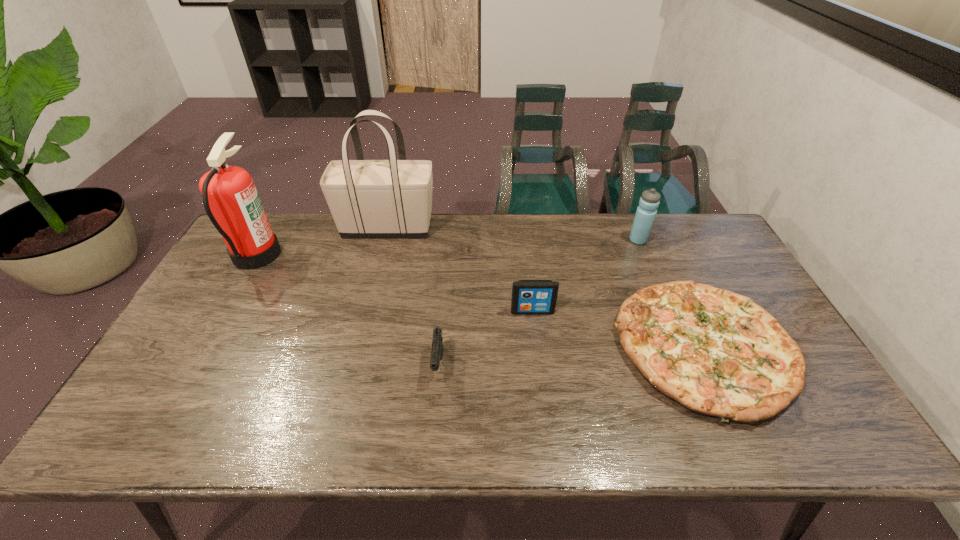
This screenshot has height=540, width=960. In order to click on shopping bag in this screenshot , I will do `click(392, 198)`.

Locate an element on the screen. The height and width of the screenshot is (540, 960). fire extinguisher is located at coordinates (230, 198).

Identify the location of water bottle. The width and height of the screenshot is (960, 540). (644, 218).

Find the location of a particular element. iPod is located at coordinates (529, 297).

Where is `the third object from right to left`? The image size is (960, 540). the third object from right to left is located at coordinates (529, 297).

At what (x,y) coordinates should I click in order to perform the action: click on pistol. Please return your answer as a coordinate pair (x, y). Image resolution: width=960 pixels, height=540 pixels. Looking at the image, I should click on (437, 349).

The height and width of the screenshot is (540, 960). I want to click on the second shortest object, so click(x=437, y=349).

Where is `pizza`? This screenshot has height=540, width=960. pizza is located at coordinates (716, 352).

Where is `free space located 0.210m with handles facing forward on the second object from left to right`? The height and width of the screenshot is (540, 960). free space located 0.210m with handles facing forward on the second object from left to right is located at coordinates (496, 227).

Identify the location of free space located 0.320m at the nozzle of the leftmost object. (377, 254).